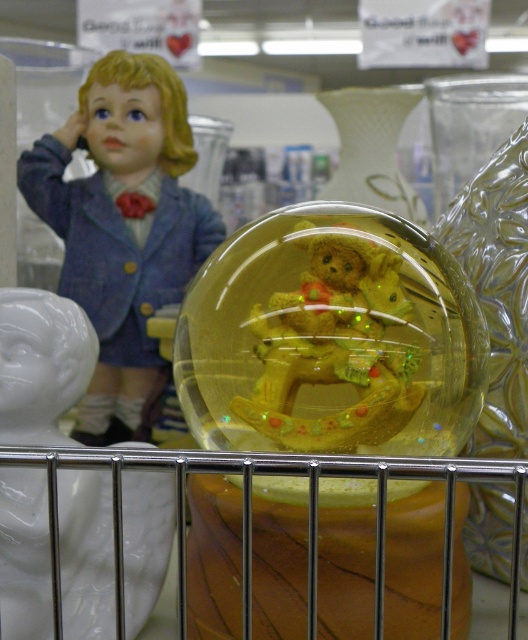
You are a customer in a store looking at the display. You see a matte blue fabric doll at upper left and a translucent yellow bear at center. Which object is located to the left of the other?

The matte blue fabric doll at upper left is positioned on the left side of the translucent yellow bear at center.

You are a customer in a store looking at the display. You want to see the translucent yellow bear at center clearly. Is the matte blue fabric doll at upper left blocking your view of it?

The translucent yellow bear at center is behind the matte blue fabric doll at upper left, so the doll is blocking the view of the bear.

In the scene shown: You are a customer in a store looking at the display. You want to know which object is wider between the matte blue fabric doll at upper left and the translucent yellow bear at center. Can you tell me?

The matte blue fabric doll at upper left is wider than the translucent yellow bear at center according to the description.